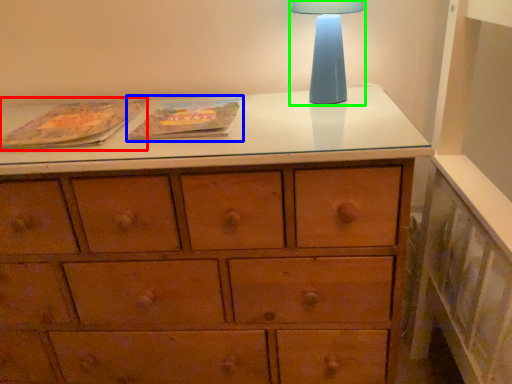
Question: Which is nearer to the paperback book (highlighted by a red box)? paperback book (highlighted by a blue box) or table lamp (highlighted by a green box).

Choices:
 (A) paperback book
 (B) table lamp

Answer: (A)